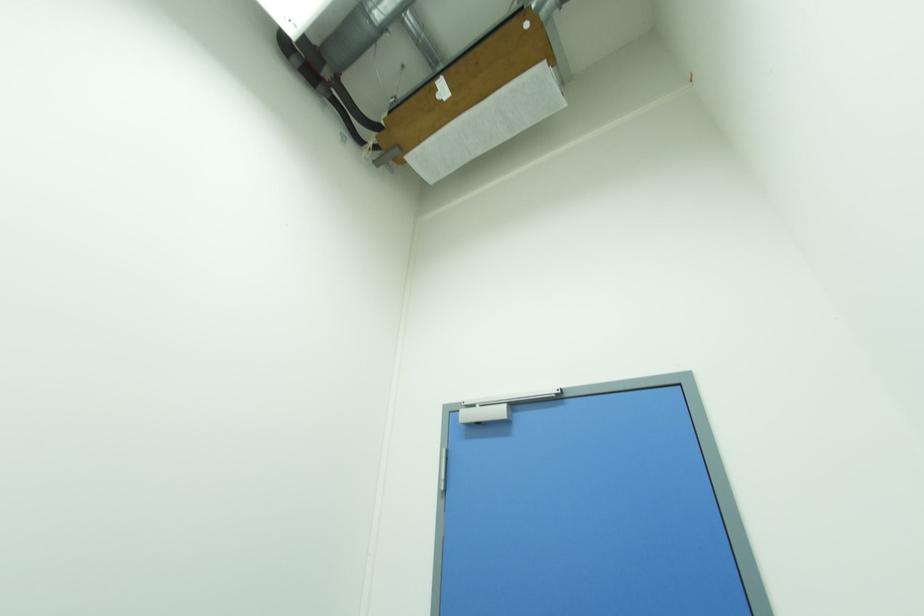
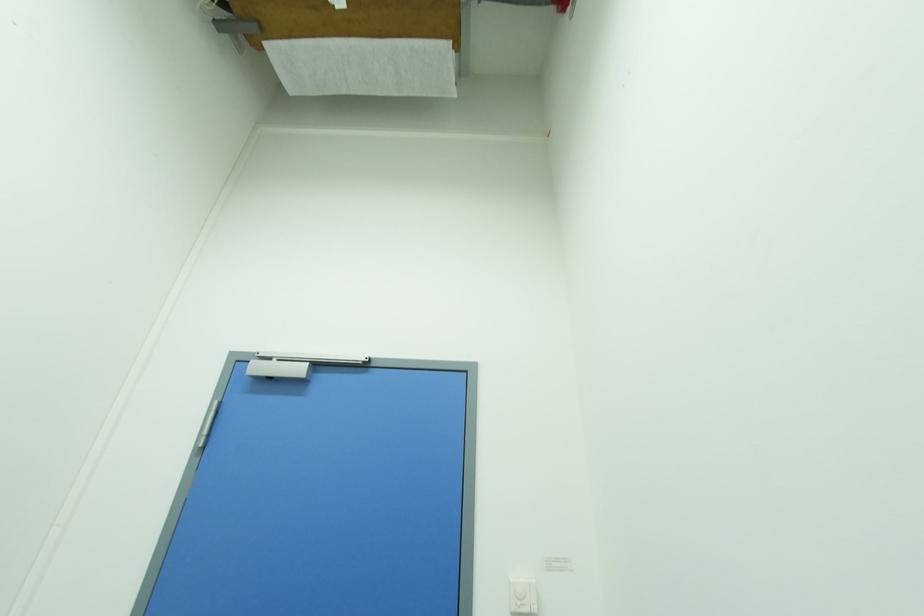
Question: The first image is from the beginning of the video and the second image is from the end. How did the camera likely rotate when shooting the video?

Choices:
 (A) Left
 (B) Right
 (C) Up
 (D) Down

Answer: (B)